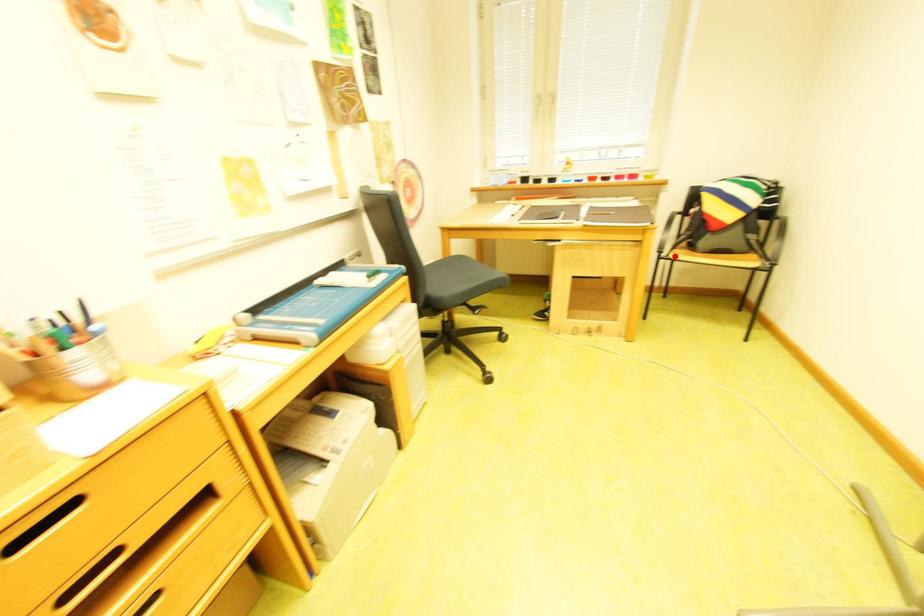
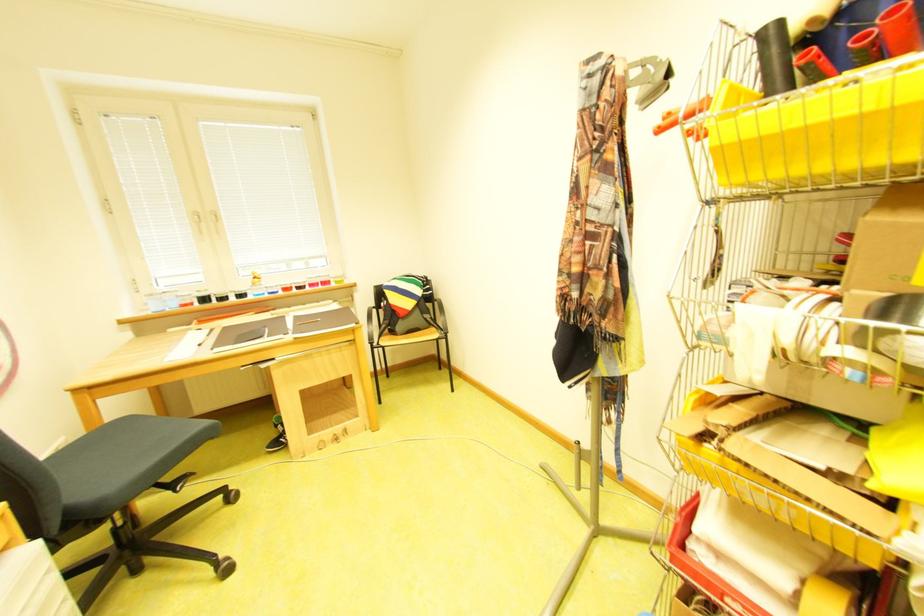
Question: I am providing you with two images of the same scene from different viewpoints. Image1 has a red point marked. In image2, the corresponding 3D location appears at what relative position? Reply with the corresponding letter.

Choices:
 (A) Closer
 (B) Farther

Answer: (A)